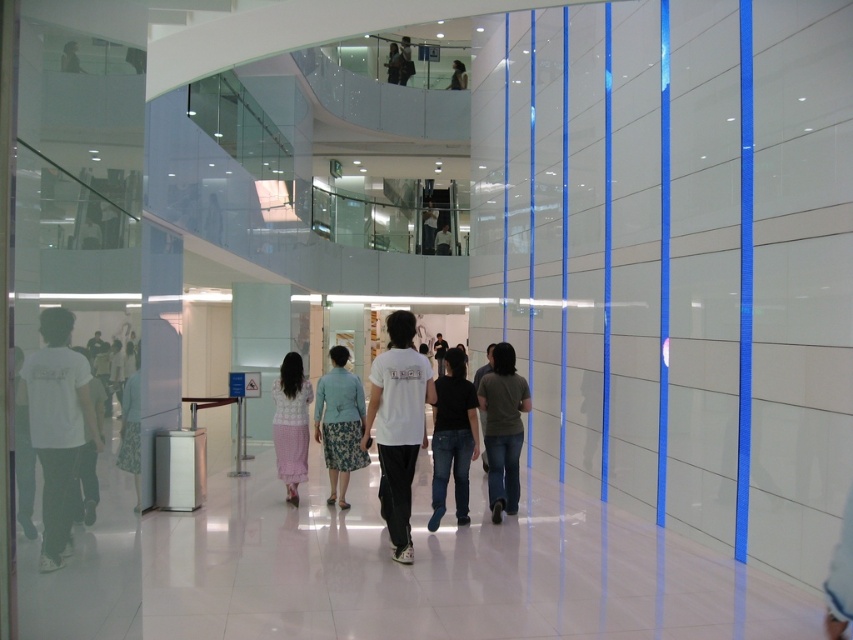
Is black denim jeans at center closer to camera compared to dark gray t-shirt at center?

Yes.

Who is lower down, black denim jeans at center or dark gray t-shirt at center?

Positioned lower is dark gray t-shirt at center.

Identify the location of black denim jeans at center. (453, 436).

The width and height of the screenshot is (853, 640). Identify the location of black denim jeans at center. (453, 436).

In the scene shown: Between black denim jeans at center and matte black shirt at upper center, which one is positioned higher?

matte black shirt at upper center is above.

Who is positioned more to the right, black denim jeans at center or matte black shirt at upper center?

Positioned to the right is black denim jeans at center.

Between point (477, 440) and point (407, 60), which one is positioned behind?

The point (407, 60) is more distant.

Find the location of a particular element. black denim jeans at center is located at coordinates (453, 436).

Who is more forward, (85,433) or (410,67)?

Point (85,433) is more forward.

Is white matte shirt at left closer to the viewer compared to matte black shirt at upper center?

Yes, white matte shirt at left is in front of matte black shirt at upper center.

Is point (38, 397) behind point (407, 51)?

No, it is not.

Where is `white matte shirt at left`? The image size is (853, 640). white matte shirt at left is located at coordinates (57, 426).